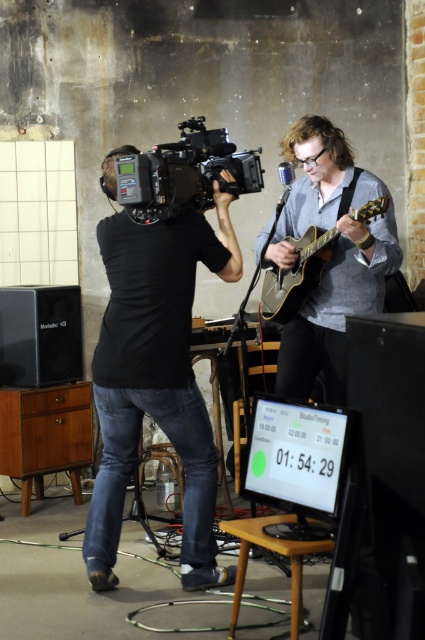
Question: Does black matte camera at center have a smaller size compared to black matte video camera at center?

Choices:
 (A) yes
 (B) no

Answer: (B)

Question: Is black matte camera at center to the right of matte gray guitar at center from the viewer's perspective?

Choices:
 (A) no
 (B) yes

Answer: (A)

Question: Which point appears closest to the camera in this image?

Choices:
 (A) (195, 192)
 (B) (153, 404)
 (C) (272, 518)
 (D) (354, 214)

Answer: (C)

Question: Does black matte camera at center lie in front of black matte video camera at center?

Choices:
 (A) yes
 (B) no

Answer: (B)

Question: Which point is farther to the camera?

Choices:
 (A) (380, 259)
 (B) (272, 282)
 (C) (306, 548)

Answer: (B)

Question: Which of the following is the closest to the observer?

Choices:
 (A) (155, 192)
 (B) (268, 548)
 (C) (297, 269)
 (D) (328, 180)

Answer: (B)